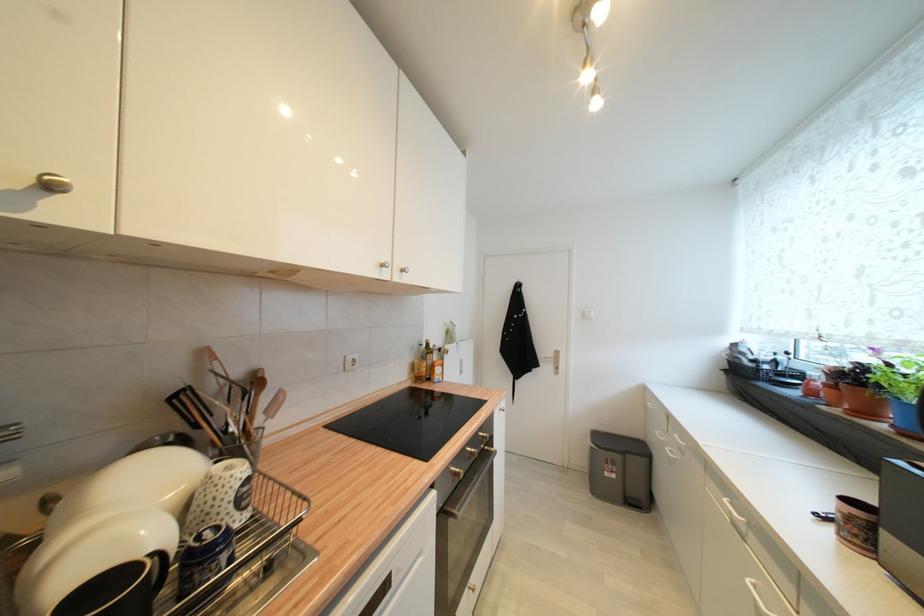
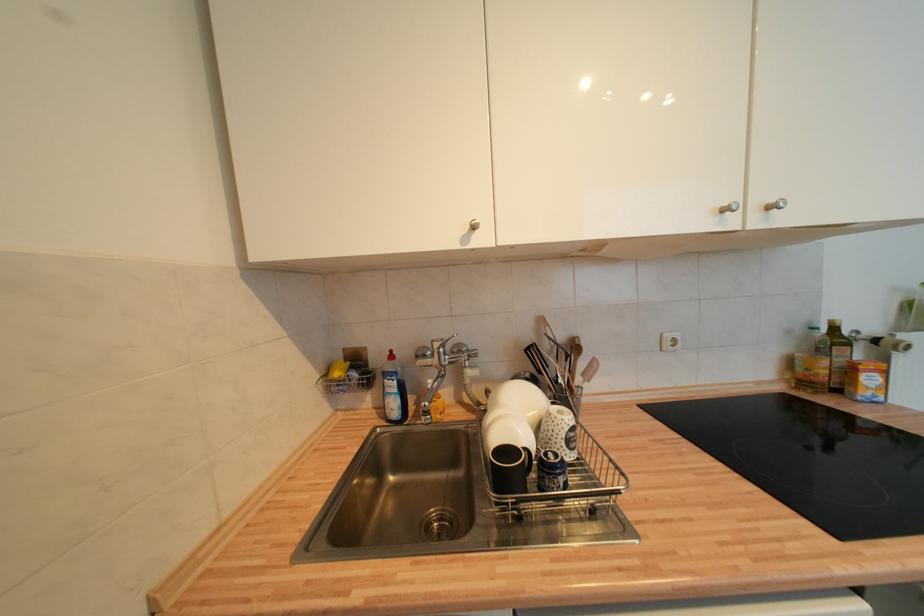
Where in the second image is the point corresponding to point (387, 267) from the first image?

(730, 212)